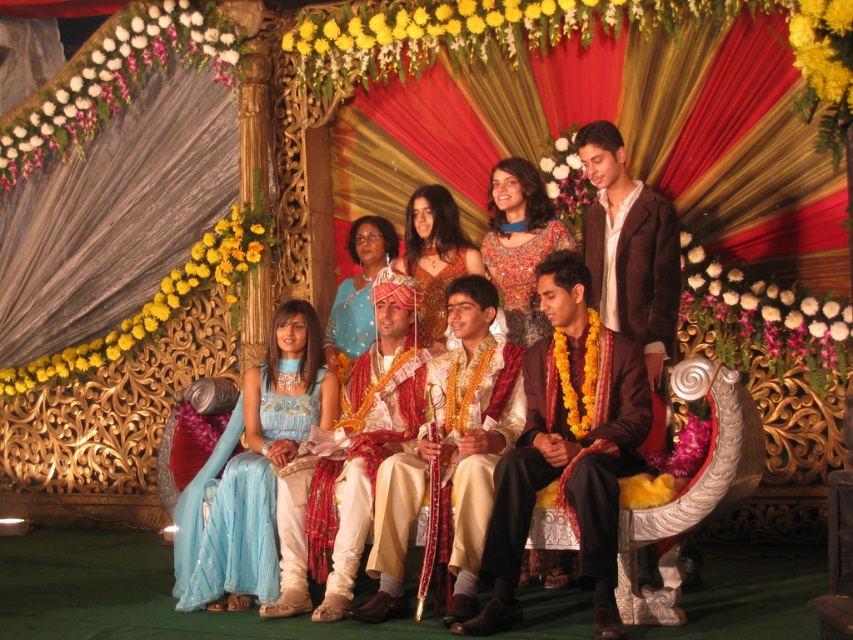
Question: Which point is closer to the camera?

Choices:
 (A) brown satin suit at center
 (B) silk white kurta at center

Answer: (B)

Question: Estimate the real-world distances between objects in this image. Which object is closer to the blue silk saree at center?

Choices:
 (A) gold sequined dress at center
 (B) shiny brown suit at center
 (C) embroidered silk blouse at center
 (D) matte gold jewelry at center

Answer: (A)

Question: Is matte gold jewelry at center behind shiny gold jewelry at center?

Choices:
 (A) no
 (B) yes

Answer: (A)

Question: Which of the following is the closest to the observer?

Choices:
 (A) (521, 250)
 (B) (466, 512)

Answer: (B)

Question: Can you confirm if light blue silk dress at center is positioned below brown satin suit at center?

Choices:
 (A) yes
 (B) no

Answer: (A)

Question: Does silk white kurta at center appear under light blue silk dress at center?

Choices:
 (A) yes
 (B) no

Answer: (B)